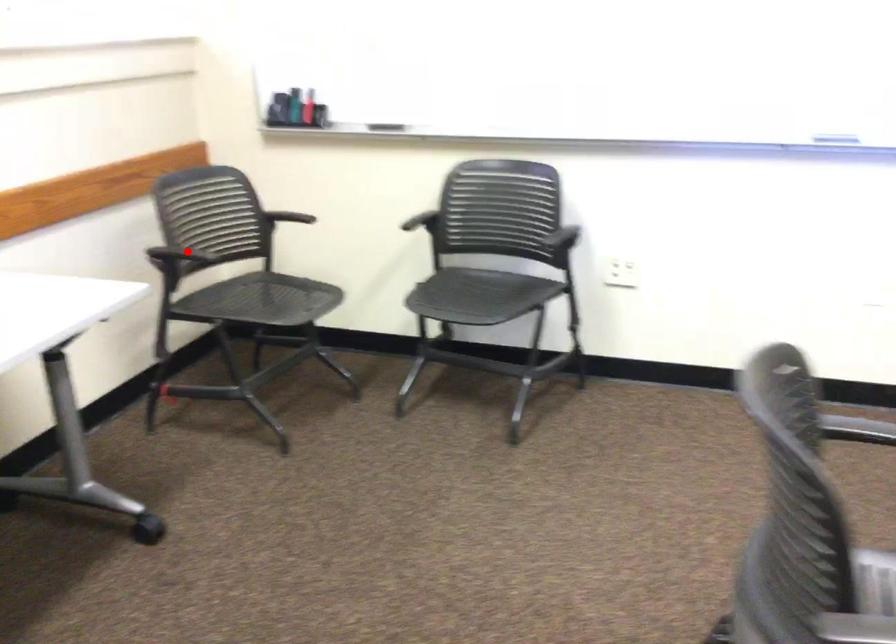
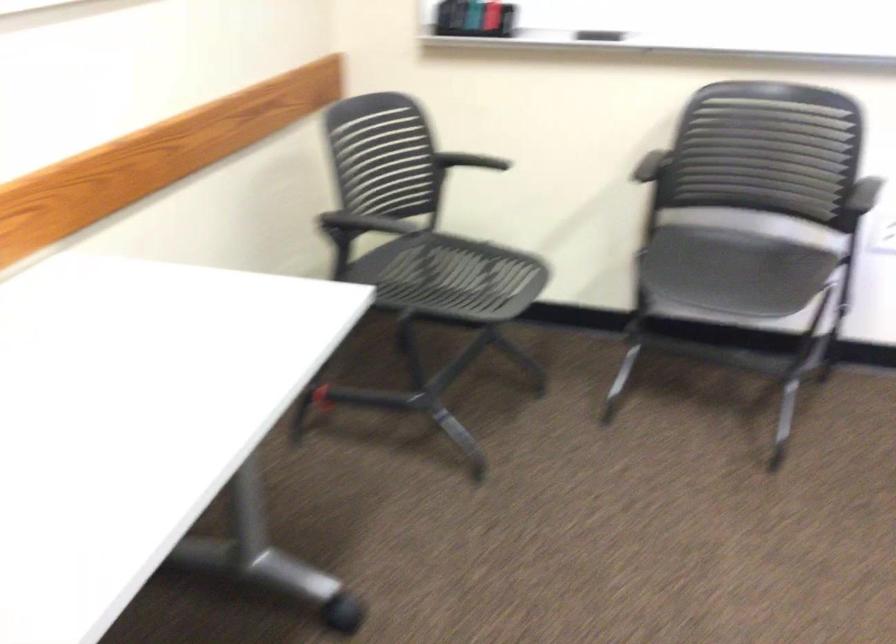
Find the pixel in the second image that matches the highlighted location in the first image.

(364, 223)